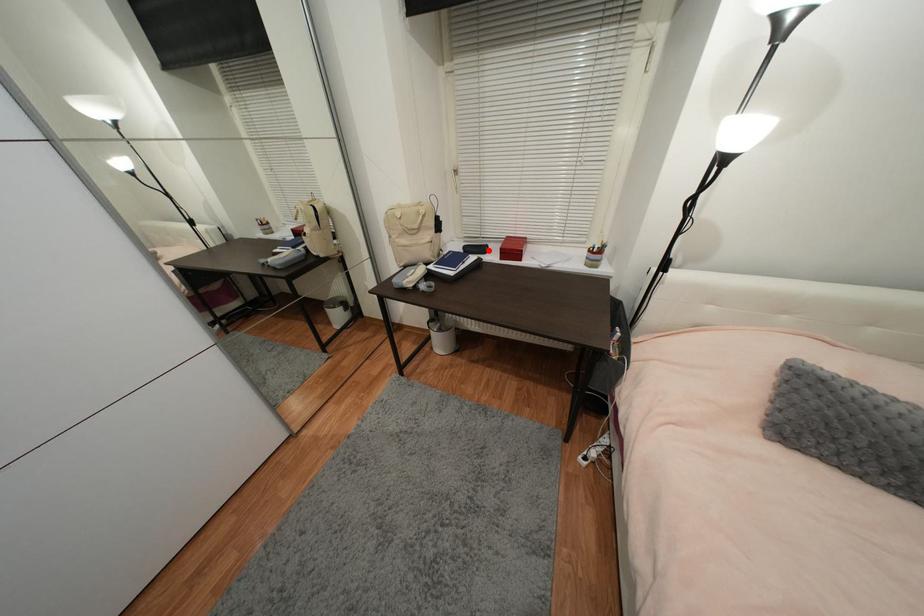
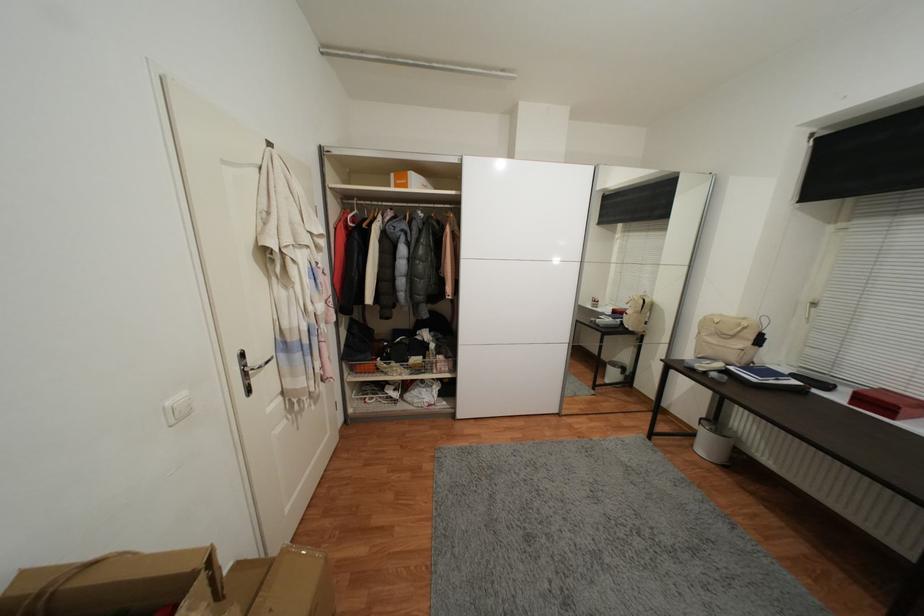
Where in the second image is the point corresponding to the highlighted location from the first image?

(831, 387)